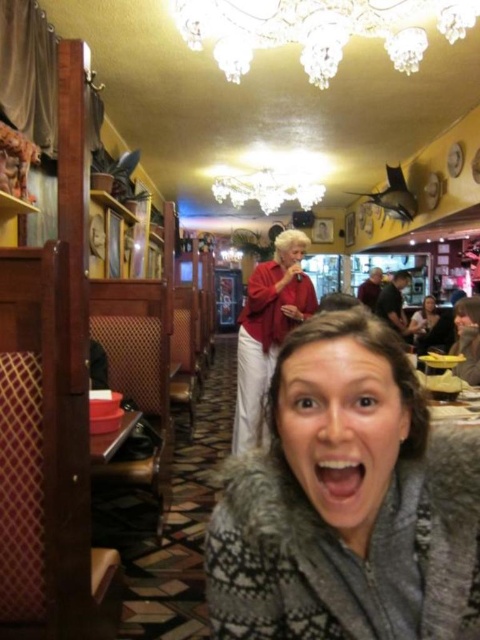
Question: Can you confirm if bright white teeth at center is positioned to the right of matte black jacket at lower right?

Choices:
 (A) yes
 (B) no

Answer: (B)

Question: Which of the following is the closest to the observer?

Choices:
 (A) crystal chandelier at upper center
 (B) shiny crystal chandelier at upper center
 (C) matte red blouse at center

Answer: (A)

Question: Which object is closer to the camera taking this photo?

Choices:
 (A) matte black jacket at lower right
 (B) crystal chandelier at upper center

Answer: (B)

Question: Among these objects, which one is nearest to the camera?

Choices:
 (A) crystal chandelier at upper center
 (B) bright white teeth at center

Answer: (B)

Question: Does crystal chandelier at upper center have a greater width compared to shiny crystal chandelier at upper center?

Choices:
 (A) yes
 (B) no

Answer: (B)

Question: Is fuzzy gray sweater at center smaller than matte red blouse at center?

Choices:
 (A) yes
 (B) no

Answer: (A)